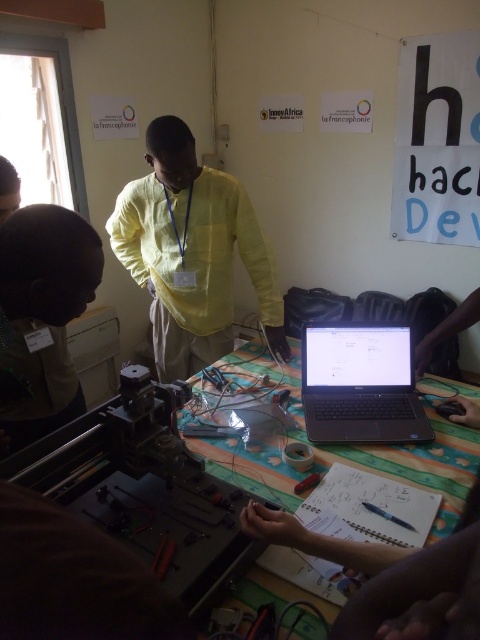
Is metallic gray machine at center wider than sleek black laptop at center?

Indeed, metallic gray machine at center has a greater width compared to sleek black laptop at center.

Consider the image. Does metallic gray machine at center have a larger size compared to sleek black laptop at center?

Indeed, metallic gray machine at center has a larger size compared to sleek black laptop at center.

In order to click on metallic gray machine at center in this screenshot , I will do `click(144, 488)`.

Where is `metallic gray machine at center`? Image resolution: width=480 pixels, height=640 pixels. metallic gray machine at center is located at coordinates (144, 488).

In the scene shown: How much distance is there between metallic gray machine at center and yellow cotton shirt at center?

metallic gray machine at center is 38.08 inches away from yellow cotton shirt at center.

Who is lower down, metallic gray machine at center or yellow cotton shirt at center?

Positioned lower is metallic gray machine at center.

Where is `metallic gray machine at center`? metallic gray machine at center is located at coordinates (144, 488).

Does metallic gray machine at center have a greater height compared to brown leather cap at upper left?

Indeed, metallic gray machine at center has a greater height compared to brown leather cap at upper left.

Is metallic gray machine at center positioned at the back of brown leather cap at upper left?

No, it is not.

At what (x,y) coordinates should I click in order to perform the action: click on metallic gray machine at center. Please return your answer as a coordinate pair (x, y). The height and width of the screenshot is (640, 480). Looking at the image, I should click on (144, 488).

Where is `metallic gray machine at center`? The image size is (480, 640). metallic gray machine at center is located at coordinates (144, 488).